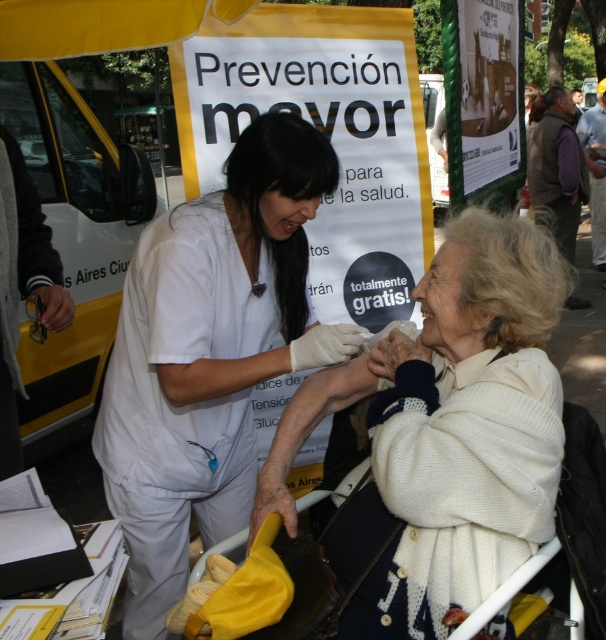
Question: Is white knitted sweater at center thinner than white matte uniform at center?

Choices:
 (A) no
 (B) yes

Answer: (A)

Question: Does white knitted sweater at center have a lesser width compared to white matte uniform at center?

Choices:
 (A) yes
 (B) no

Answer: (B)

Question: Which point is farther to the camera?

Choices:
 (A) white matte uniform at center
 (B) white knitted sweater at center

Answer: (A)

Question: Can you confirm if white knitted sweater at center is positioned to the left of white matte uniform at center?

Choices:
 (A) no
 (B) yes

Answer: (A)

Question: Which point is closer to the camera?

Choices:
 (A) (373, 372)
 (B) (241, 172)

Answer: (A)